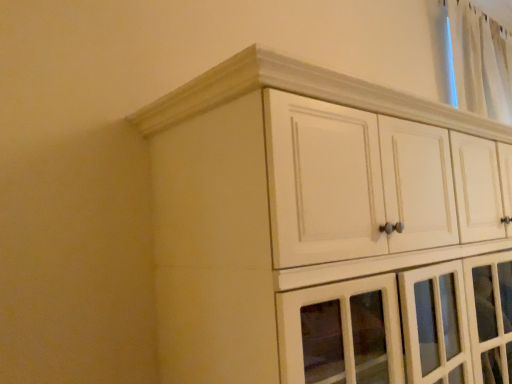
Question: Looking at their shapes, would you say white sheer curtain at upper right is wider or thinner than white wood cupboard at upper center?

Choices:
 (A) thin
 (B) wide

Answer: (A)

Question: Does point (462, 16) appear closer or farther from the camera than point (422, 292)?

Choices:
 (A) closer
 (B) farther

Answer: (B)

Question: Considering the positions of white sheer curtain at upper right and white wood cupboard at upper center in the image, is white sheer curtain at upper right taller or shorter than white wood cupboard at upper center?

Choices:
 (A) tall
 (B) short

Answer: (B)

Question: Does point (265, 109) appear closer or farther from the camera than point (480, 87)?

Choices:
 (A) farther
 (B) closer

Answer: (B)

Question: Considering the positions of white wood cupboard at upper center and white sheer curtain at upper right in the image, is white wood cupboard at upper center taller or shorter than white sheer curtain at upper right?

Choices:
 (A) short
 (B) tall

Answer: (B)

Question: Is white wood cupboard at upper center in front of or behind white sheer curtain at upper right in the image?

Choices:
 (A) behind
 (B) front

Answer: (B)

Question: Considering the positions of white wood cupboard at upper center and white sheer curtain at upper right in the image, is white wood cupboard at upper center bigger or smaller than white sheer curtain at upper right?

Choices:
 (A) big
 (B) small

Answer: (A)